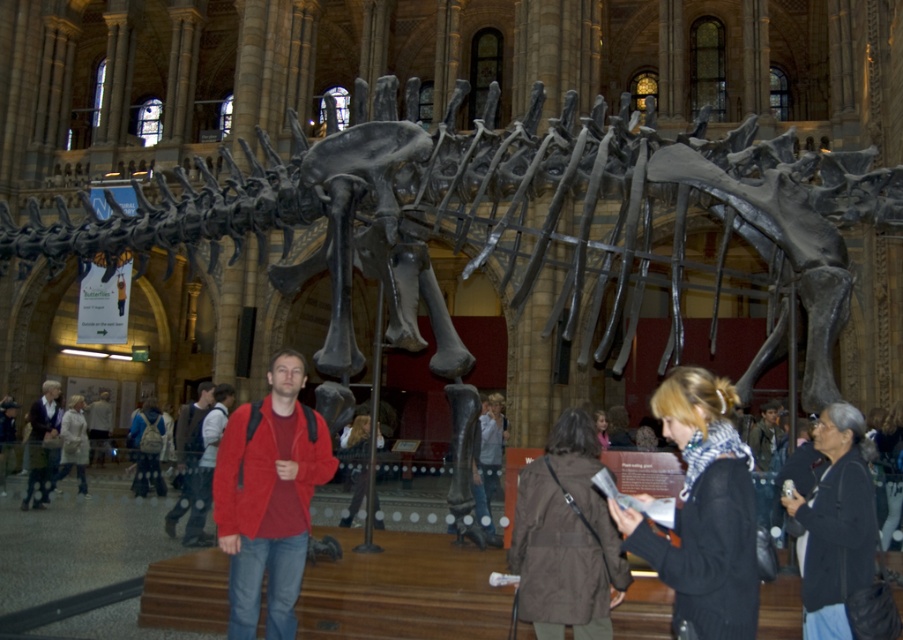
You are standing in the museum hall and notice a red sweater at center. If you want to find its exact location on a map of the hall, what coordinates would you use?

The red sweater at center is located at coordinates point (358, 436).

You are a visitor in the museum and see both the black leather jacket at lower right and the red jacket at center. Which jacket is smaller in size?

The black leather jacket at lower right is smaller than the red jacket at center.

You are a security guard in the museum and need to determine if the black leather jacket at lower right can be placed under the red jacket at center without blocking the view of the dinosaur skeleton. Can it fit vertically?

The black leather jacket at lower right is shorter than the red jacket at center, so it can be placed under the red jacket at center without blocking the view of the dinosaur skeleton since it is shorter in height.